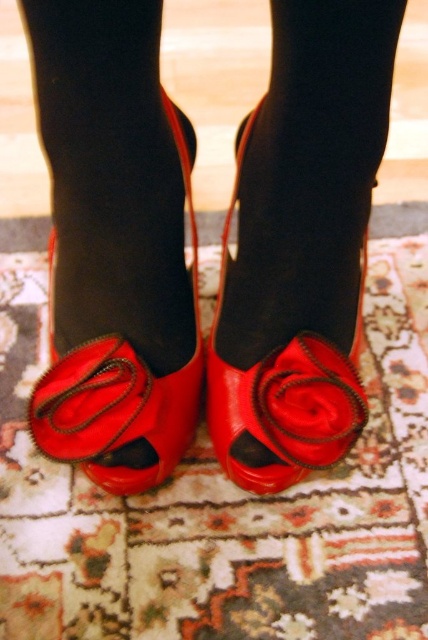
Question: Does shiny patent leather sandal at center appear over shiny red rose at center?

Choices:
 (A) yes
 (B) no

Answer: (A)

Question: Among these points, which one is nearest to the camera?

Choices:
 (A) (50, 259)
 (B) (270, 435)
 (C) (255, 212)

Answer: (B)

Question: Is shiny patent leather shoes at center positioned in front of shiny patent leather sandal at center?

Choices:
 (A) no
 (B) yes

Answer: (B)

Question: Does shiny patent leather sandal at center appear under shiny red rose at center?

Choices:
 (A) yes
 (B) no

Answer: (B)

Question: Which point is farther to the camera?

Choices:
 (A) (110, 234)
 (B) (306, 349)
 (C) (222, 369)
 (D) (50, 458)

Answer: (C)

Question: Which object is positioned farthest from the shiny patent leather sandal at center?

Choices:
 (A) shiny patent leather shoes at center
 (B) shiny leather sandal at center
 (C) shiny red rose at center

Answer: (C)